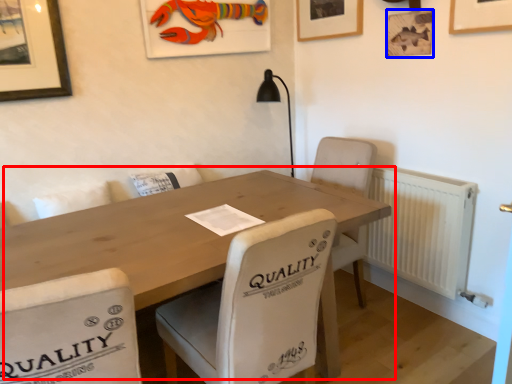
Question: Which object appears farthest to the camera in this image, table (highlighted by a red box) or picture frame (highlighted by a blue box)?

Choices:
 (A) table
 (B) picture frame

Answer: (B)